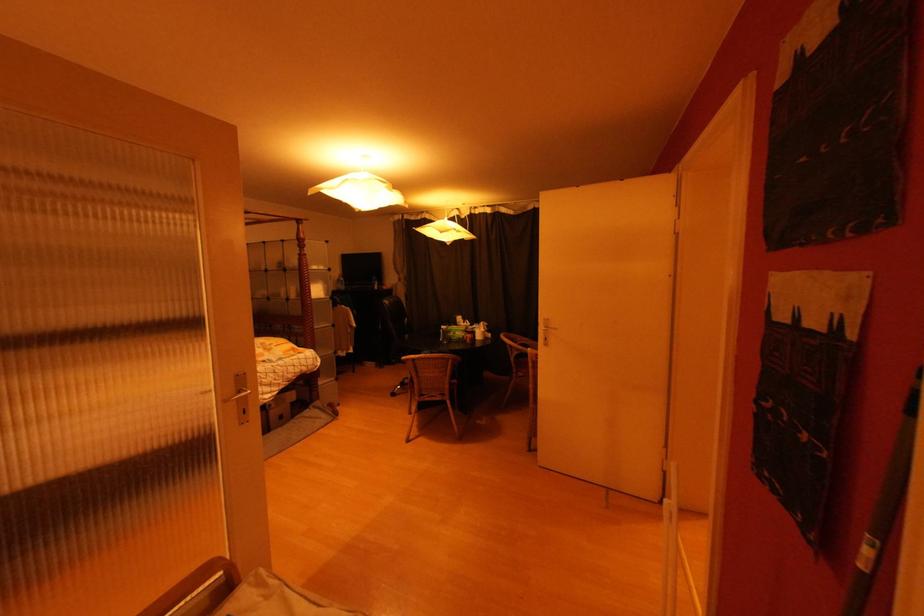
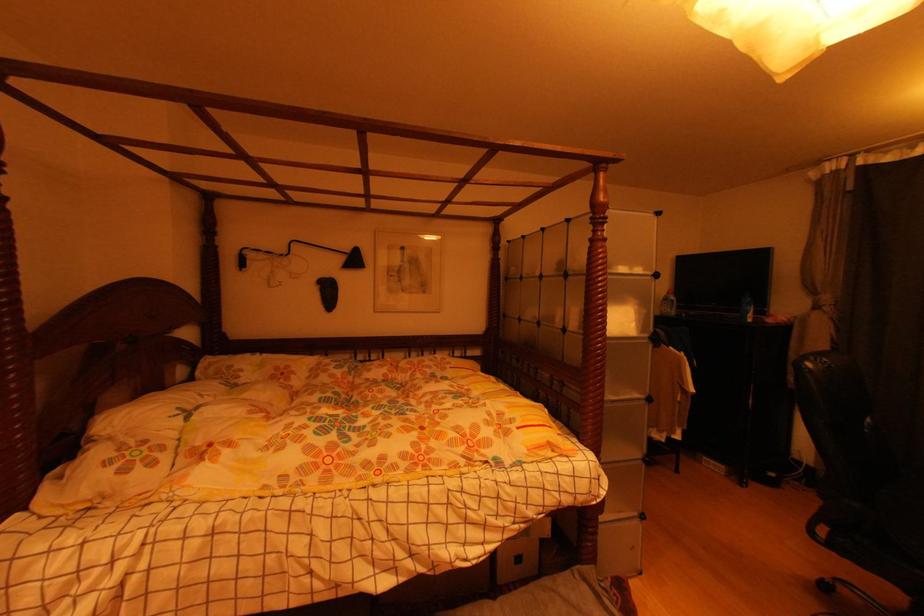
Find the pixel in the second image that matches [283,392] in the first image.

(504, 545)